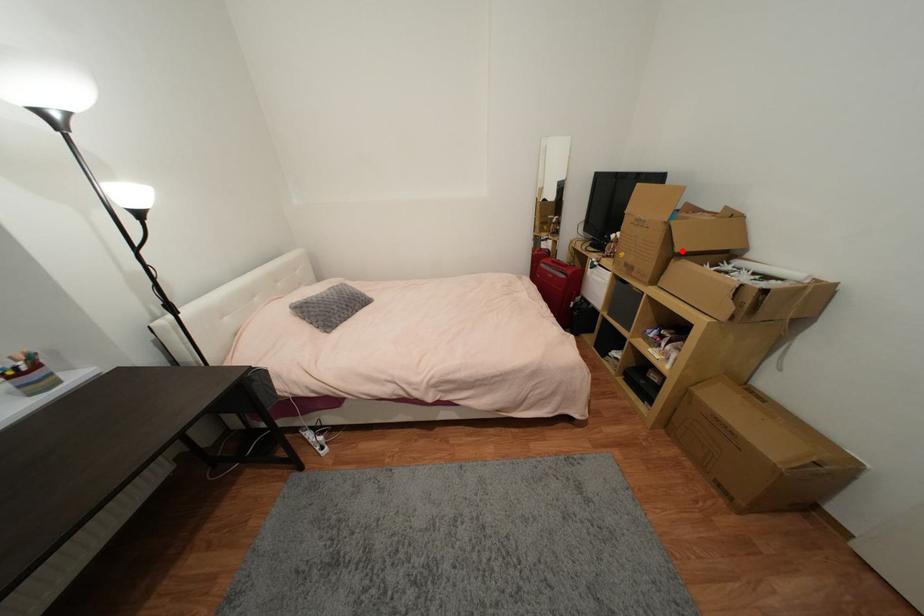
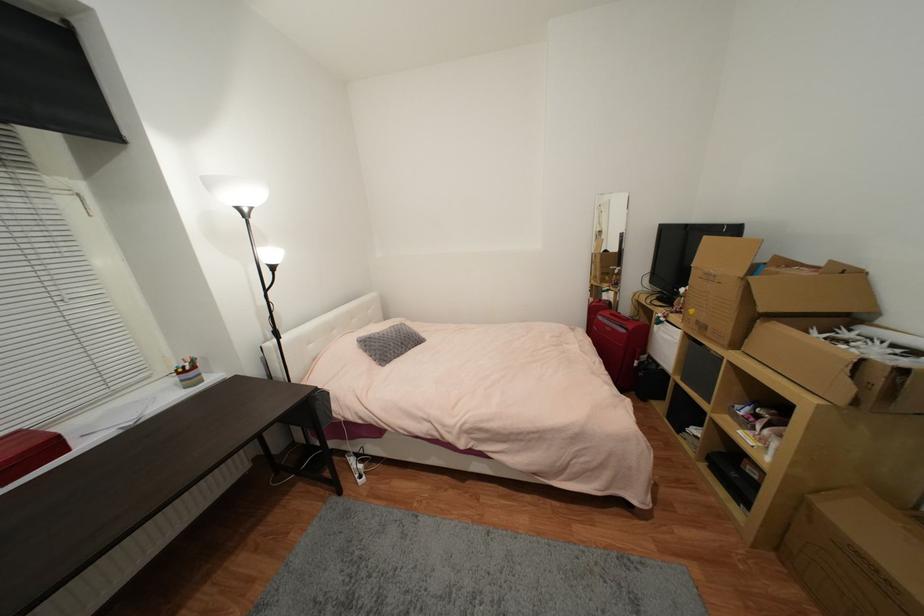
Question: I am providing you with two images of the same scene from different viewpoints. In image1, a red point is highlighted. Considering the same 3D point in image2, which of the following is correct?

Choices:
 (A) It is closer
 (B) It is farther

Answer: (B)